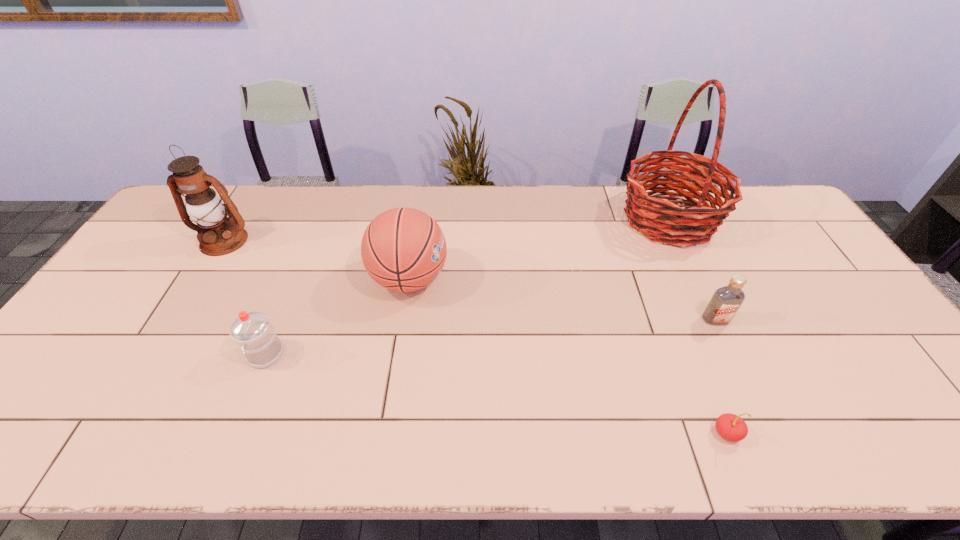
The width and height of the screenshot is (960, 540). Find the location of `free space that satisfies the following two spatial constraints: 1. on the handle side of the nearest object; 2. on the left side of the water bottle`. free space that satisfies the following two spatial constraints: 1. on the handle side of the nearest object; 2. on the left side of the water bottle is located at coordinates (234, 433).

Where is `vacant space that satisfies the following two spatial constraints: 1. on the front side of the basket; 2. on the logo side of the fourth shortest object`? This screenshot has width=960, height=540. vacant space that satisfies the following two spatial constraints: 1. on the front side of the basket; 2. on the logo side of the fourth shortest object is located at coordinates (697, 279).

You are a GUI agent. You are given a task and a screenshot of the screen. Output one action in this format:
    pyautogui.click(x=<x>, y=<y>)
    Task: Click on the vacant space that satisfies the following two spatial constraints: 1. on the front side of the basket; 2. on the logo side of the third tallest object
    The height and width of the screenshot is (540, 960).
    Given the screenshot: What is the action you would take?
    pyautogui.click(x=697, y=279)